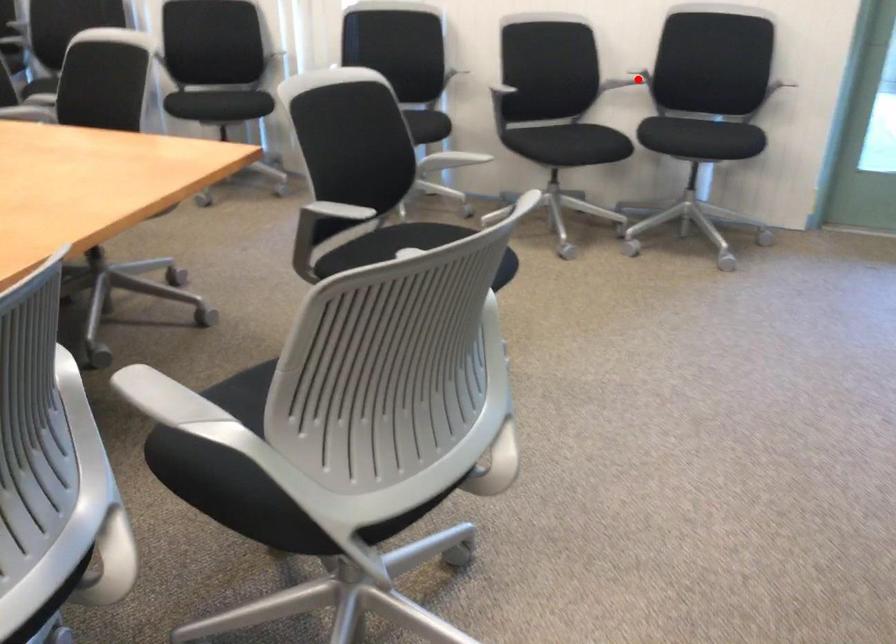
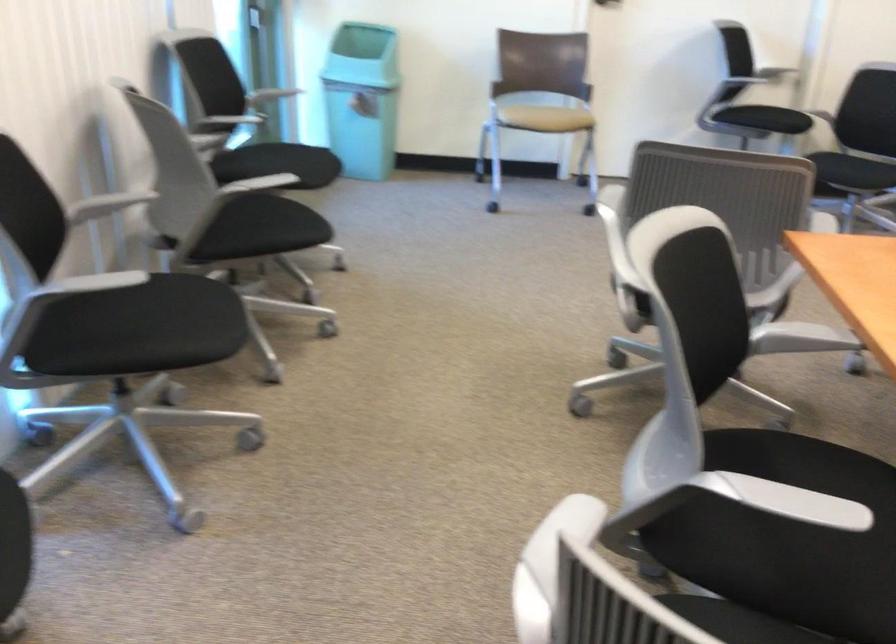
Question: I am providing you with two images of the same scene from different viewpoints. A red point is marked on the first image. Can you still see the location of the red point in image 2?

Choices:
 (A) Yes
 (B) No

Answer: (B)